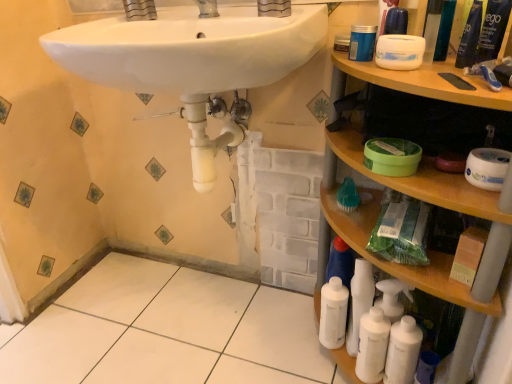
The width and height of the screenshot is (512, 384). Identify the location of vacant space behind white plastic bottle at lower right. (298, 311).